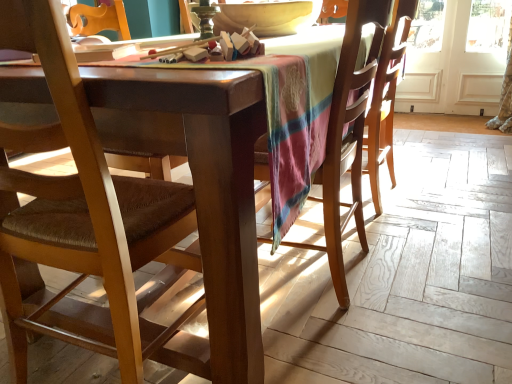
Question: From a real-world perspective, does matte yellow bowl at upper center sit lower than white wood screen door at upper right?

Choices:
 (A) no
 (B) yes

Answer: (A)

Question: Is matte yellow bowl at upper center far from white wood screen door at upper right?

Choices:
 (A) yes
 (B) no

Answer: (A)

Question: Can you confirm if matte yellow bowl at upper center is smaller than white wood screen door at upper right?

Choices:
 (A) yes
 (B) no

Answer: (B)

Question: Does matte yellow bowl at upper center have a greater height compared to white wood screen door at upper right?

Choices:
 (A) no
 (B) yes

Answer: (A)

Question: Is white wood screen door at upper right at the back of matte yellow bowl at upper center?

Choices:
 (A) yes
 (B) no

Answer: (B)

Question: Relative to brown fabric chair at left, the first chair in the left-to-right sequence, is white wood screen door at upper right in front or behind?

Choices:
 (A) front
 (B) behind

Answer: (B)

Question: Based on their sizes in the image, would you say white wood screen door at upper right is bigger or smaller than brown fabric chair at left, the first chair in the left-to-right sequence?

Choices:
 (A) small
 (B) big

Answer: (A)

Question: From a real-world perspective, relative to brown fabric chair at left, the first chair in the left-to-right sequence, is white wood screen door at upper right vertically above or below?

Choices:
 (A) above
 (B) below

Answer: (B)

Question: In the image, is white wood screen door at upper right on the left side or the right side of brown fabric chair at left, the first chair in the left-to-right sequence?

Choices:
 (A) right
 (B) left

Answer: (A)

Question: Considering the positions of white wood screen door at upper right and matte yellow bowl at upper center in the image, is white wood screen door at upper right wider or thinner than matte yellow bowl at upper center?

Choices:
 (A) wide
 (B) thin

Answer: (B)

Question: From a real-world perspective, is white wood screen door at upper right positioned above or below matte yellow bowl at upper center?

Choices:
 (A) below
 (B) above

Answer: (A)

Question: Considering the positions of point (508, 0) and point (226, 29), is point (508, 0) closer or farther from the camera than point (226, 29)?

Choices:
 (A) closer
 (B) farther

Answer: (B)

Question: Is white wood screen door at upper right in front of or behind matte yellow bowl at upper center in the image?

Choices:
 (A) behind
 (B) front

Answer: (A)

Question: Considering the positions of point (508, 18) and point (379, 29), is point (508, 18) closer or farther from the camera than point (379, 29)?

Choices:
 (A) closer
 (B) farther

Answer: (B)

Question: From the image's perspective, is white wood screen door at upper right positioned above or below wooden chair at center, marked as the 1th chair in a right-to-left arrangement?

Choices:
 (A) above
 (B) below

Answer: (A)